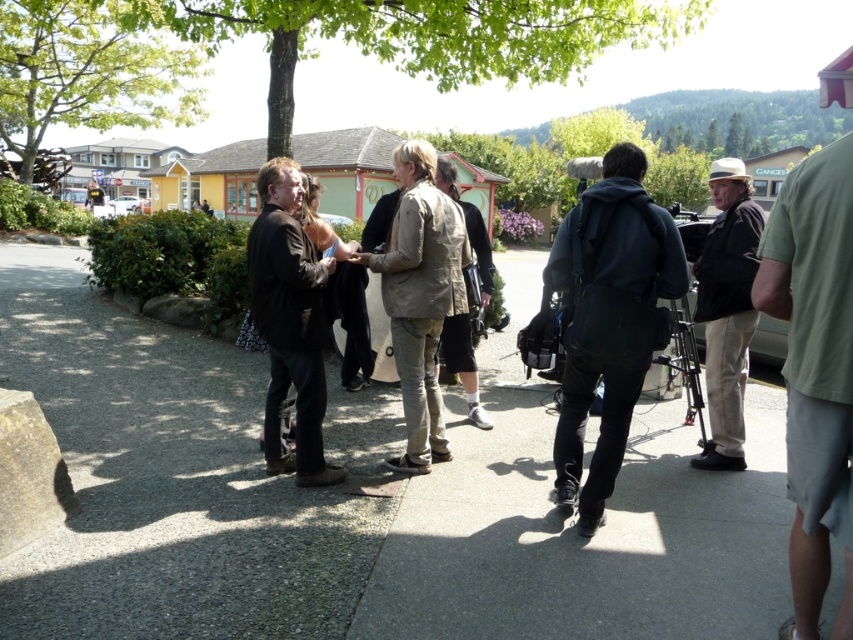
In the scene shown: You are planning to take a photo of the khaki cotton pants at center and the green leafy tree at upper left. Which object should you focus on first if you want to capture both in the frame without moving the camera?

The green leafy tree at upper left should be focused on first because its width surpasses the khaki cotton pants at center, ensuring it fits within the frame.